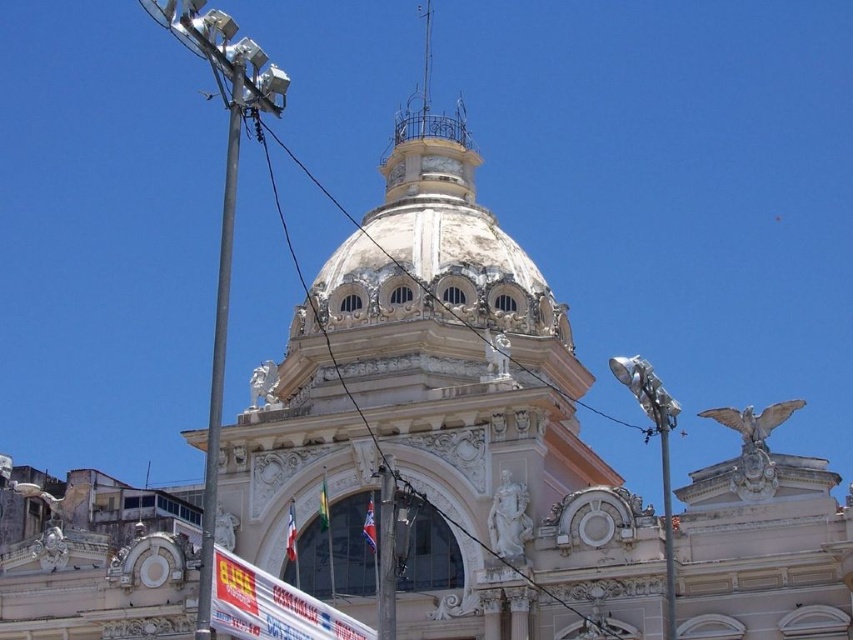
Question: Is metallic pole at left in front of metallic pole at center?

Choices:
 (A) yes
 (B) no

Answer: (A)

Question: Which object is farther from the camera taking this photo?

Choices:
 (A) white glossy banner at lower center
 (B) white wire at center
 (C) metallic pole at right
 (D) metallic pole at center

Answer: (C)

Question: Which object is the farthest from the white glossy banner at lower center?

Choices:
 (A) metallic pole at center
 (B) metallic pole at right

Answer: (B)

Question: Does white stone dome at center appear under metallic pole at center?

Choices:
 (A) no
 (B) yes

Answer: (A)

Question: Which object is farther from the camera taking this photo?

Choices:
 (A) white glossy banner at lower center
 (B) white wire at center
 (C) metallic pole at left

Answer: (B)

Question: Can you confirm if metallic pole at left is bigger than metallic pole at center?

Choices:
 (A) yes
 (B) no

Answer: (A)